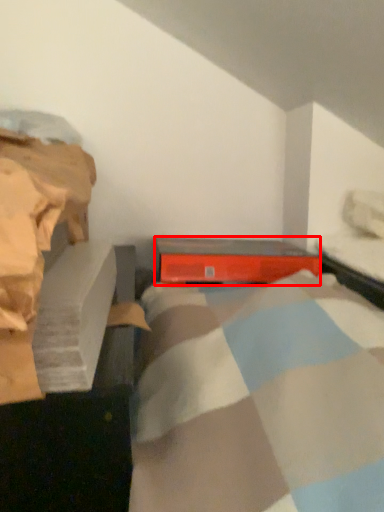
Question: Observing the image, what is the correct spatial positioning of equipment (annotated by the red box) in reference to bed frame?

Choices:
 (A) right
 (B) left

Answer: (B)